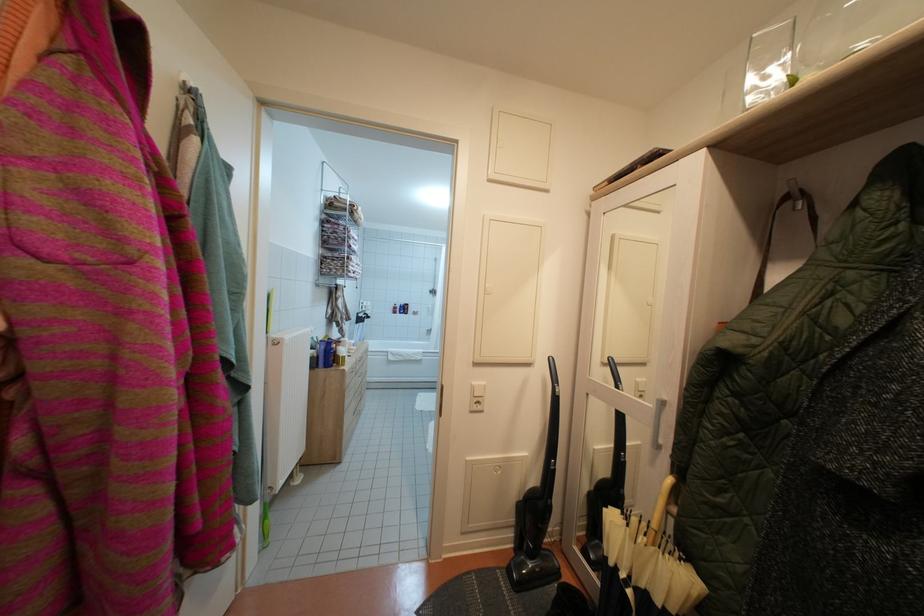
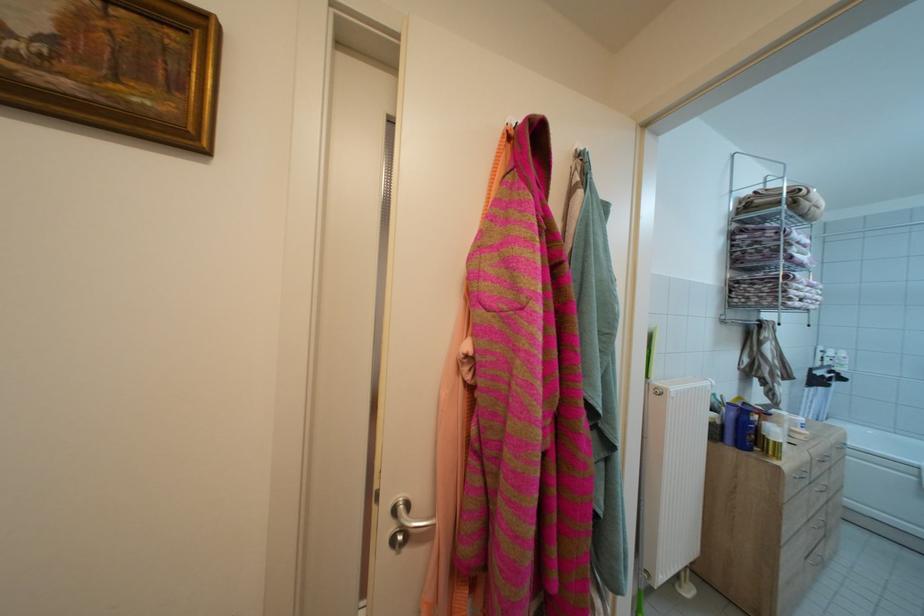
Where in the second image is the point corresponding to pixel 298 483 from the first image?

(685, 584)